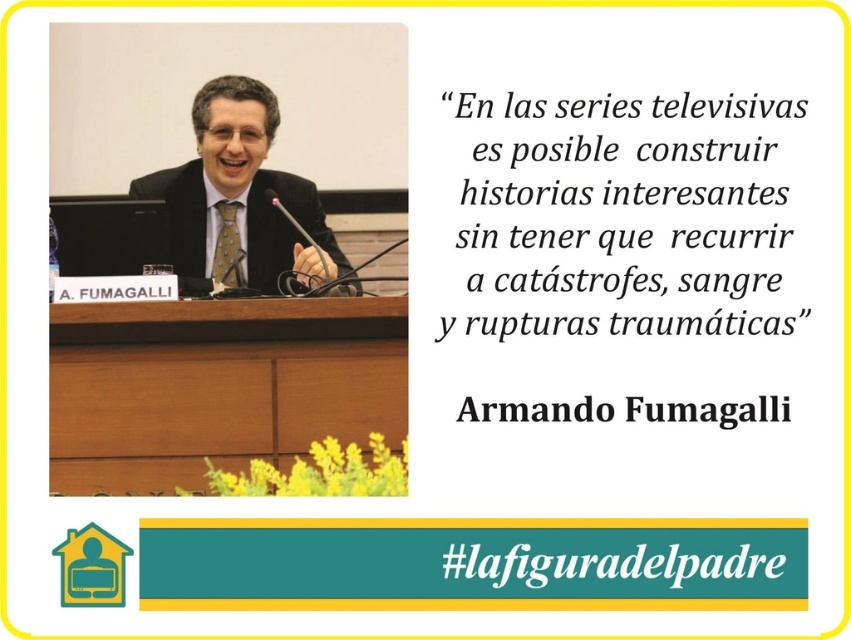
Question: Can you confirm if black paper quote at upper center is smaller than black text at center?

Choices:
 (A) yes
 (B) no

Answer: (B)

Question: Which object appears closest to the camera in this image?

Choices:
 (A) black paper quote at upper center
 (B) black text at center

Answer: (A)

Question: Which point is closer to the camera?

Choices:
 (A) (429, 189)
 (B) (317, 266)
 (C) (80, 237)

Answer: (A)

Question: Which point is closer to the camera?

Choices:
 (A) (627, 566)
 (B) (607, 417)
 (C) (111, 205)

Answer: (A)

Question: From the image, what is the correct spatial relationship of matte black suit at center in relation to #black paper at upper center?

Choices:
 (A) left
 (B) right

Answer: (A)

Question: Can you confirm if black paper quote at upper center is wider than matte black laptop at lower left?

Choices:
 (A) yes
 (B) no

Answer: (A)